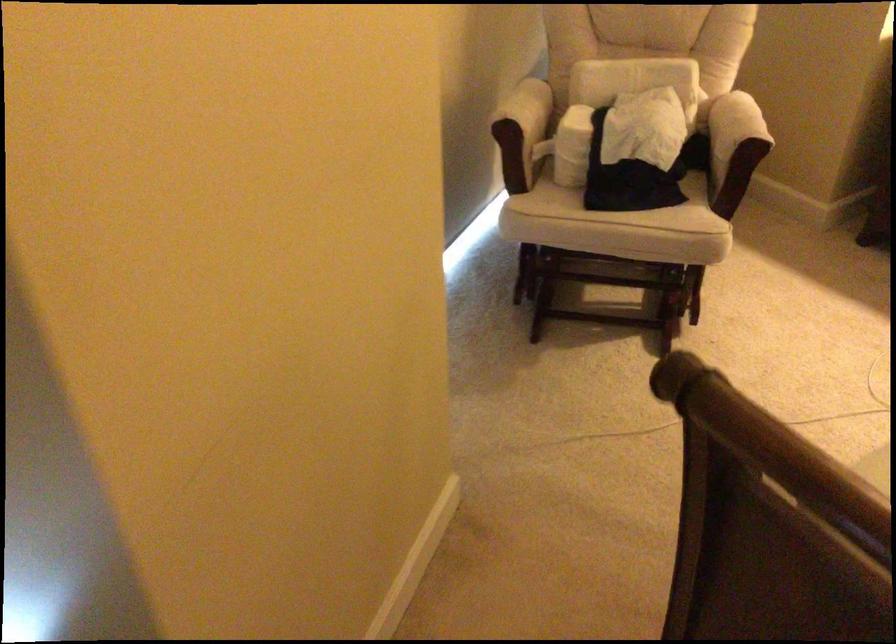
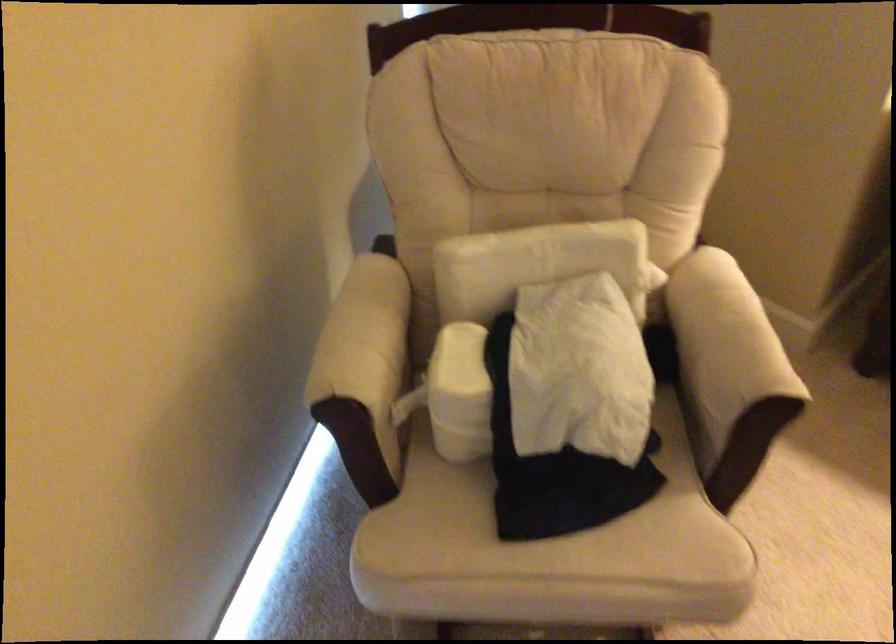
Find the pixel in the second image that matches (x=738, y=122) in the first image.

(724, 348)